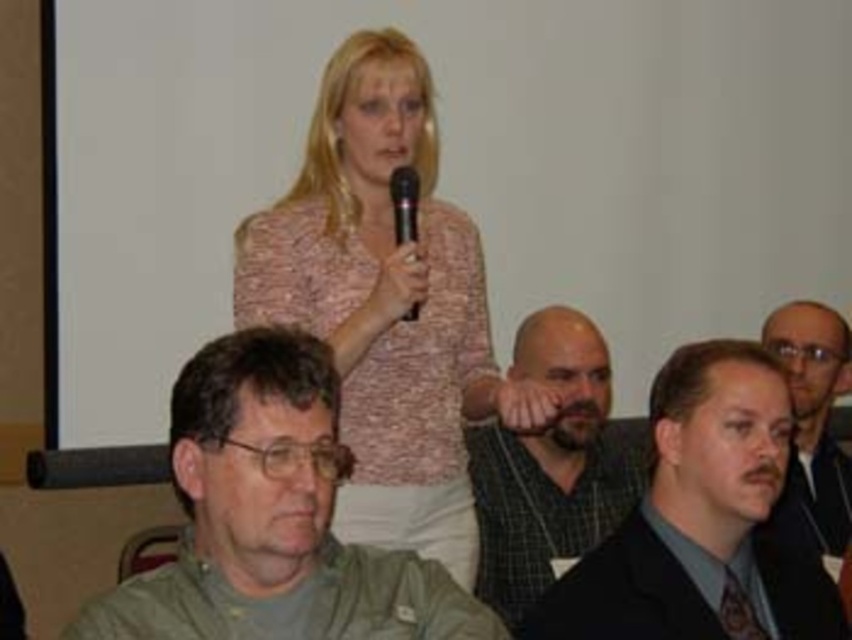
Question: Does checkered fabric shirt at center appear on the left side of smooth black suit at right?

Choices:
 (A) yes
 (B) no

Answer: (A)

Question: Which point is farther to the camera?

Choices:
 (A) (343, 429)
 (B) (413, 196)
 (C) (505, 589)

Answer: (C)

Question: Which of these objects is positioned closest to the black plastic microphone at center?

Choices:
 (A) dark gray suit at center
 (B) pink textured sweater at upper center
 (C) smooth black suit at right
 (D) checkered fabric shirt at center

Answer: (B)

Question: Which of the following is the farthest from the observer?

Choices:
 (A) checkered fabric shirt at center
 (B) dark gray suit at center

Answer: (A)

Question: In this image, where is smooth black suit at right located relative to black plastic microphone at center?

Choices:
 (A) right
 (B) left

Answer: (A)

Question: Does green matte shirt at lower left come behind dark gray suit at center?

Choices:
 (A) no
 (B) yes

Answer: (A)